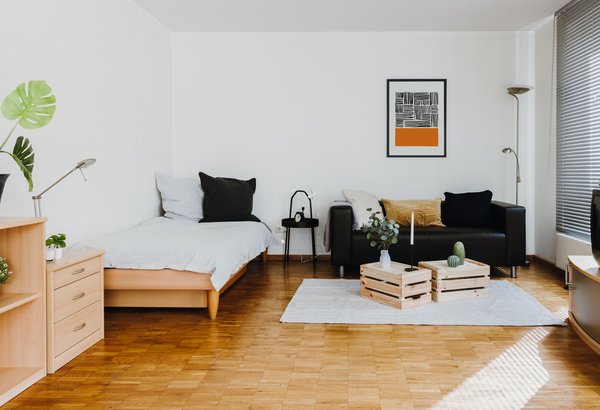
The width and height of the screenshot is (600, 410). In order to click on painting in this screenshot , I will do `click(417, 119)`.